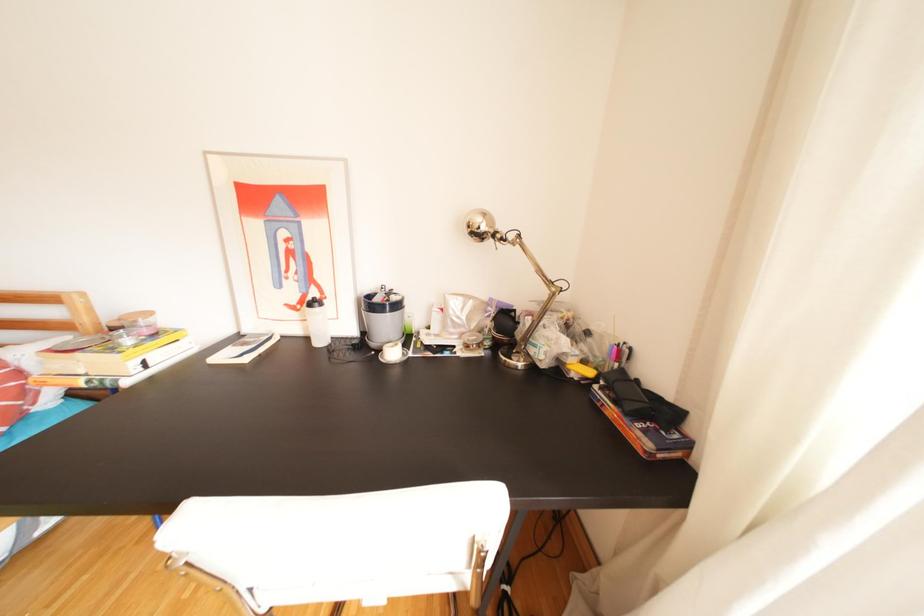
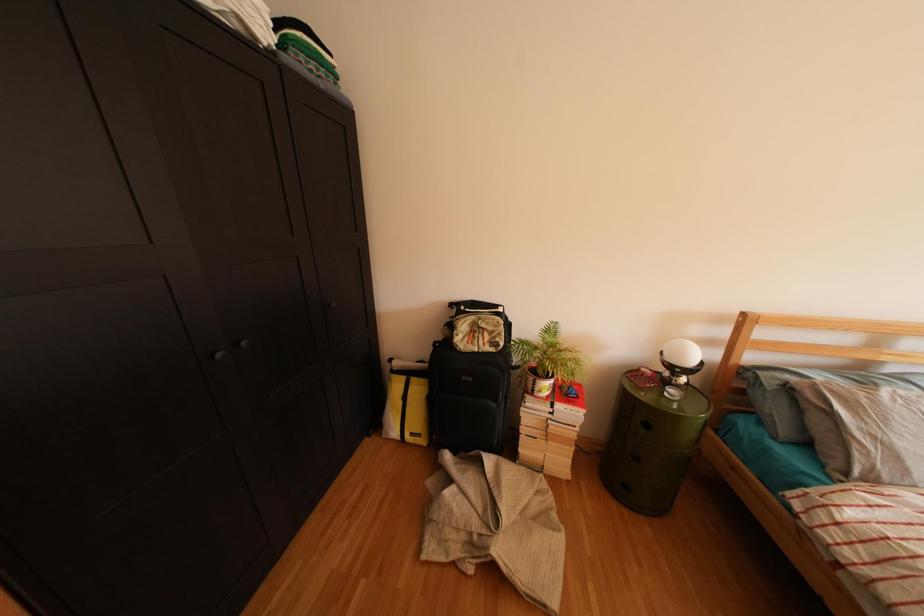
Question: What movement of the cameraman would produce the second image?

Choices:
 (A) Left
 (B) Right
 (C) Forward
 (D) Backward

Answer: (A)